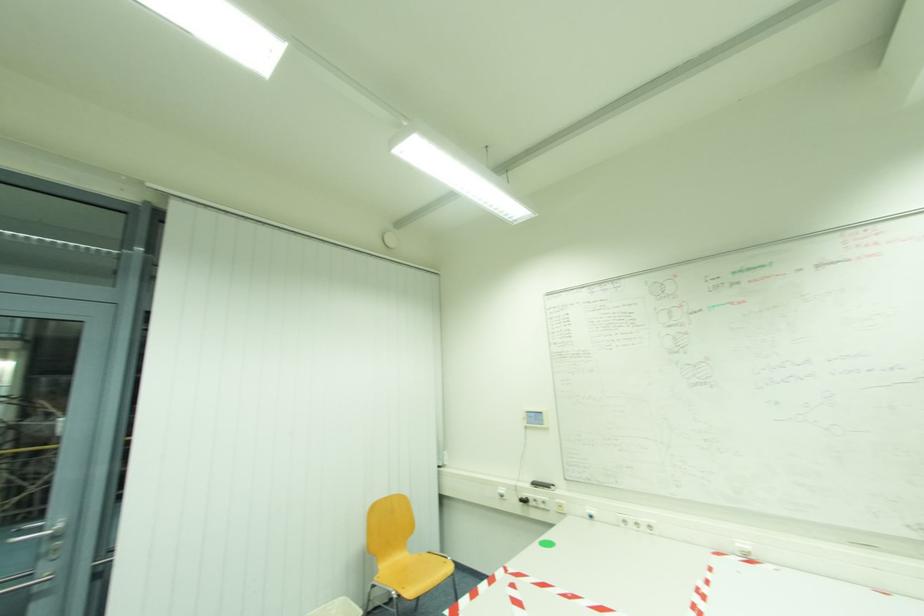
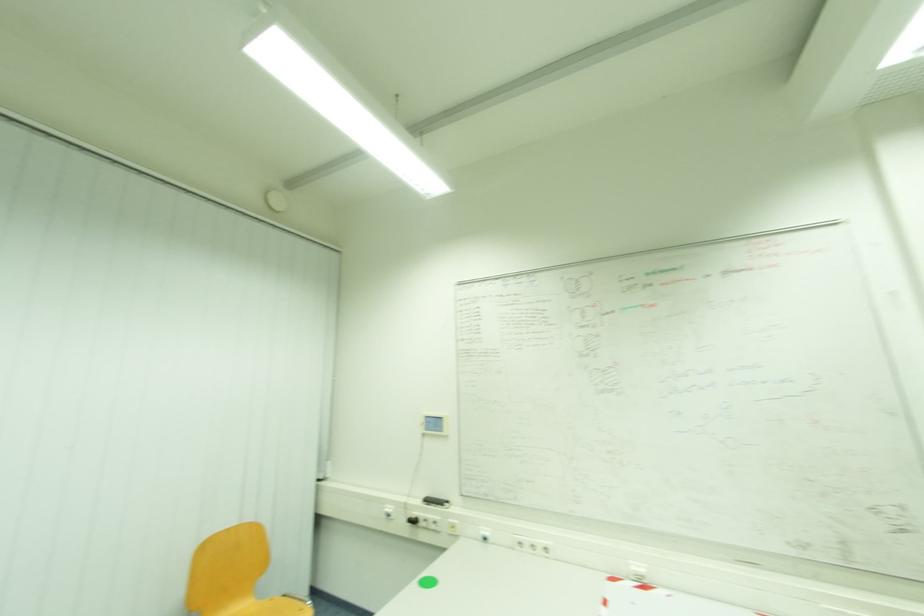
Question: Based on the continuous images, in which direction is the camera rotating? Reply with the corresponding letter.

Choices:
 (A) Left
 (B) Right
 (C) Up
 (D) Down

Answer: (B)